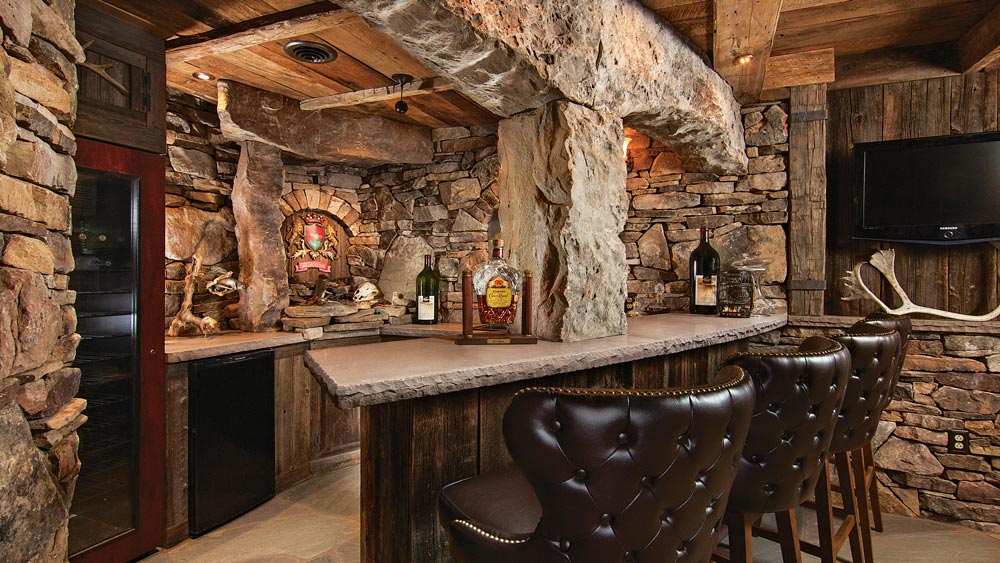
At what (x,y) coordinates should I click in order to perform the action: click on dishwasher. Please return your answer as a coordinate pair (x, y). Looking at the image, I should click on (234, 454).